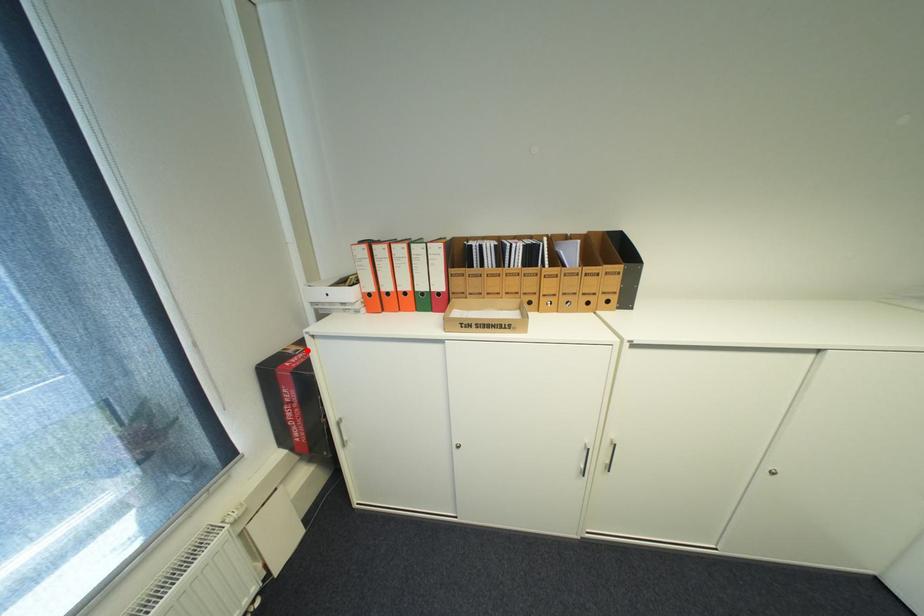
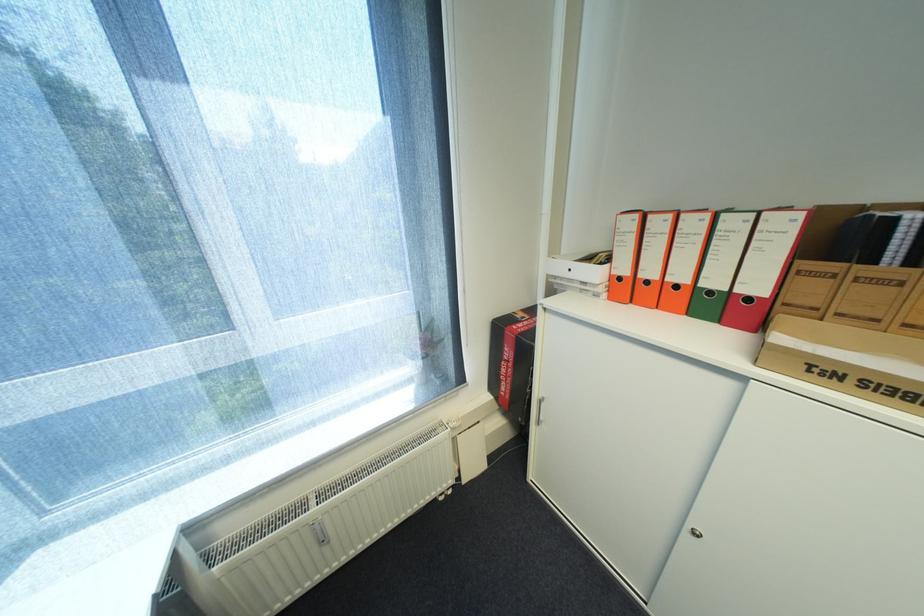
Question: I am providing you with two images of the same scene from different viewpoints. In image1, a red point is highlighted. Considering the same 3D point in image2, which of the following is correct?

Choices:
 (A) It is closer
 (B) It is farther

Answer: (A)